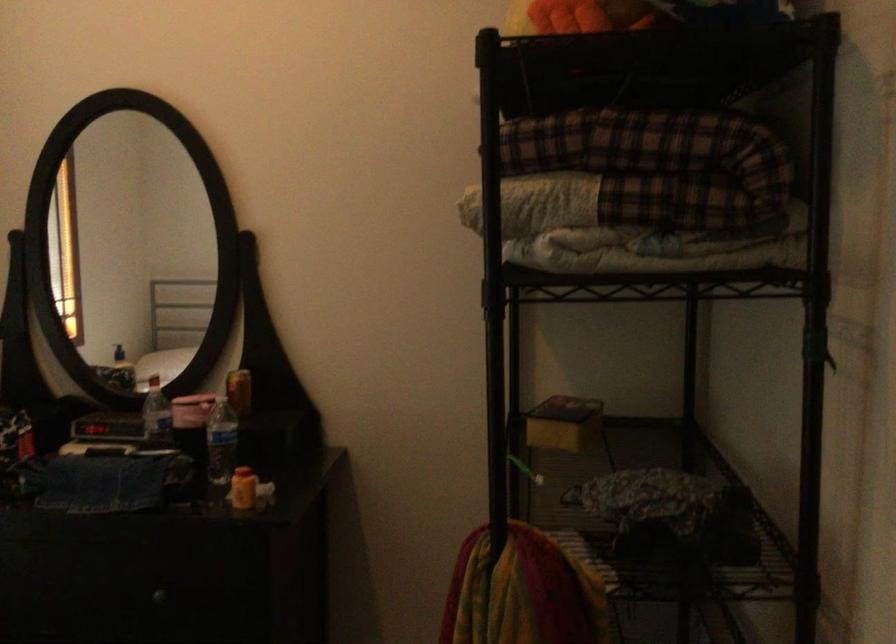
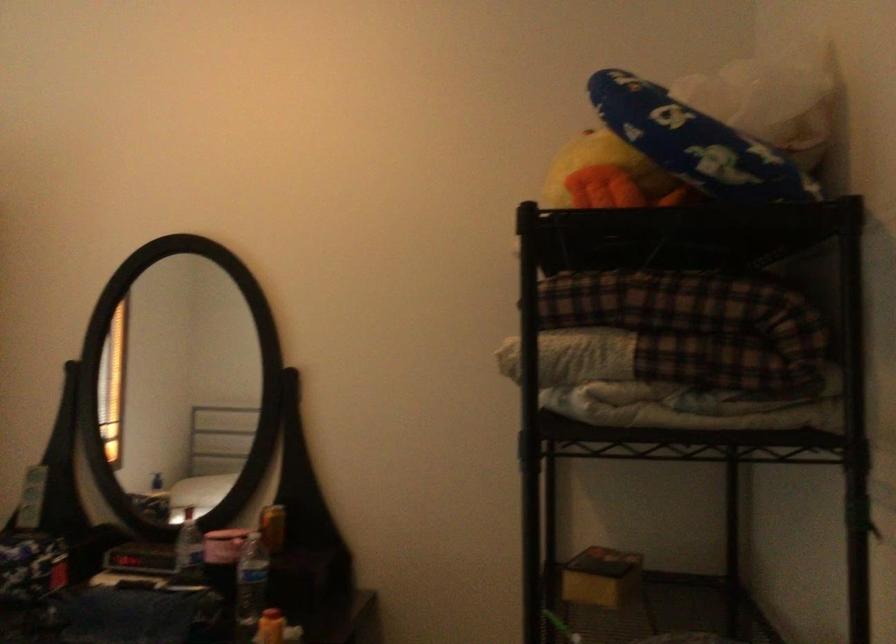
Question: The images are taken continuously from a first-person perspective. In which direction is your viewpoint rotating?

Choices:
 (A) Left
 (B) Right
 (C) Up
 (D) Down

Answer: (C)